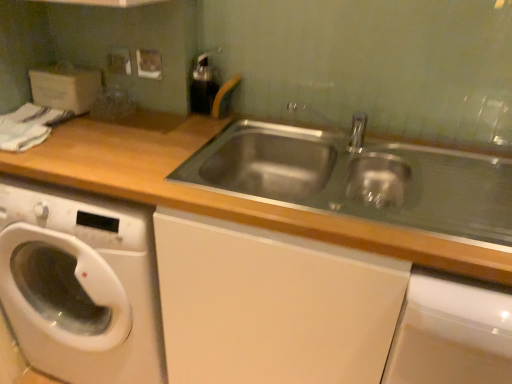
Question: Considering the positions of metallic silver electric outlet at upper left and wooden at left in the image, is metallic silver electric outlet at upper left wider or thinner than wooden at left?

Choices:
 (A) thin
 (B) wide

Answer: (A)

Question: From the image's perspective, relative to wooden at left, is metallic silver electric outlet at upper left above or below?

Choices:
 (A) below
 (B) above

Answer: (B)

Question: Which object is positioned closest to the wooden at left?

Choices:
 (A) metallic silver electric outlet at upper left
 (B) white glossy washing machine at lower left

Answer: (B)

Question: Which is farther from the metallic silver electric outlet at upper left?

Choices:
 (A) wooden at left
 (B) white glossy washing machine at lower left

Answer: (B)